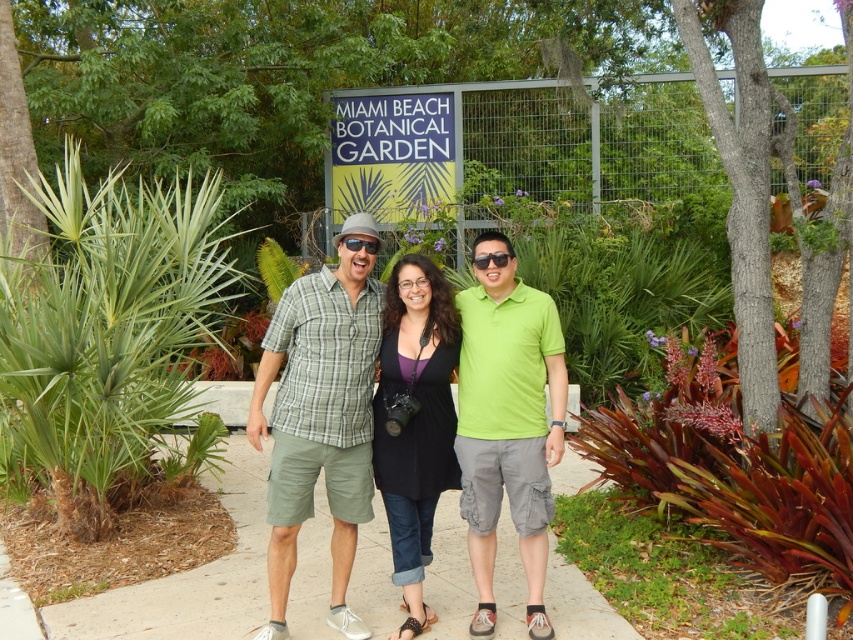
Question: Does plaid cotton shirt at center have a greater width compared to black matte dress at center?

Choices:
 (A) no
 (B) yes

Answer: (B)

Question: Is green plaid shirt at center smaller than matte black sunglasses at center?

Choices:
 (A) yes
 (B) no

Answer: (B)

Question: Does plaid cotton shirt at center appear on the right side of green matte sunglasses at center?

Choices:
 (A) yes
 (B) no

Answer: (B)

Question: Which is nearer to the green leafy plant at left?

Choices:
 (A) plaid cotton shirt at center
 (B) green plaid shirt at center
 (C) matte black sunglasses at center

Answer: (B)

Question: Estimate the real-world distances between objects in this image. Which object is farther from the leathery red leaf at right?

Choices:
 (A) matte black sunglasses at center
 (B) green matte sunglasses at center
 (C) green leafy plant at left

Answer: (C)

Question: Among these points, which one is farthest from the camera?

Choices:
 (A) coord(682,621)
 (B) coord(480,266)

Answer: (B)